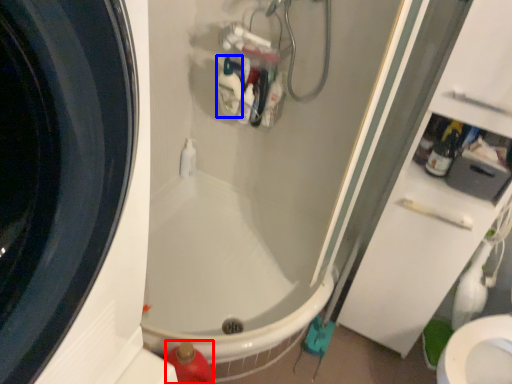
Question: Which object is closer to the camera taking this photo, cleaning product (highlighted by a red box) or cleaning product (highlighted by a blue box)?

Choices:
 (A) cleaning product
 (B) cleaning product

Answer: (A)